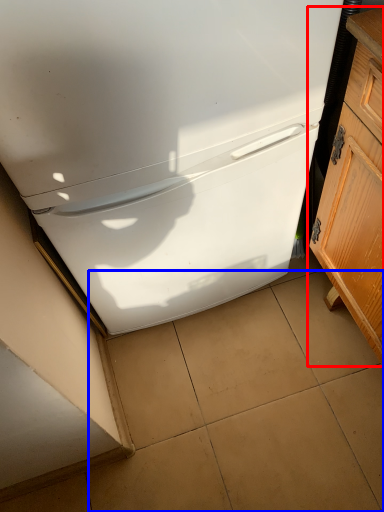
Question: Which object appears closest to the camera in this image, cabinetry (highlighted by a red box) or tile (highlighted by a blue box)?

Choices:
 (A) cabinetry
 (B) tile

Answer: (A)